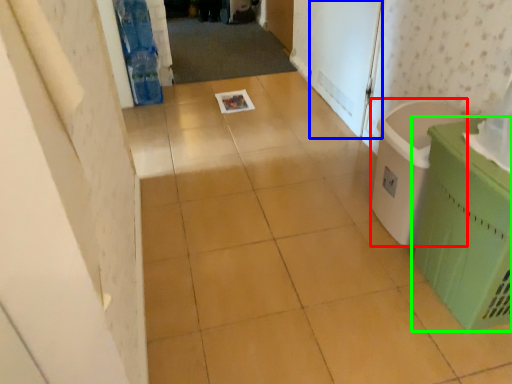
Question: Which is farther away from laundry basket (highlighted by a red box)? screen door (highlighted by a blue box) or waste container (highlighted by a green box)?

Choices:
 (A) screen door
 (B) waste container

Answer: (A)